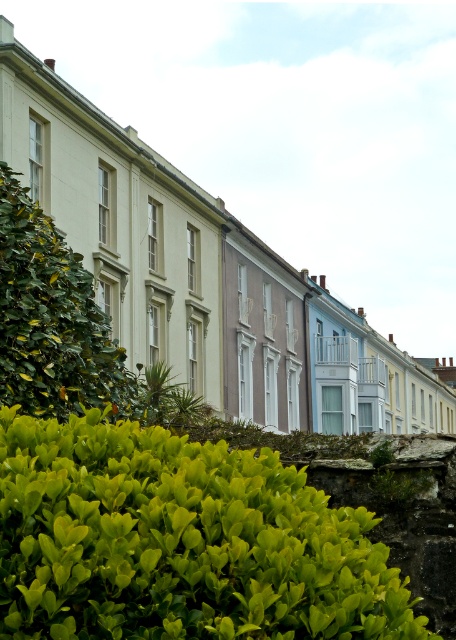
Can you confirm if green leafy hedge at lower left is bigger than green leafy hedge at left?

No.

Who is taller, green leafy hedge at lower left or green leafy hedge at left?

Standing taller between the two is green leafy hedge at left.

At what (x,y) coordinates should I click in order to perform the action: click on green leafy hedge at lower left. Please return your answer as a coordinate pair (x, y). Looking at the image, I should click on (180, 541).